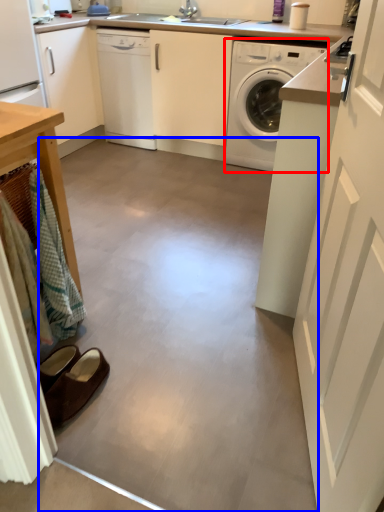
Question: Which object appears farthest to the camera in this image, washing machine (highlighted by a red box) or concrete (highlighted by a blue box)?

Choices:
 (A) washing machine
 (B) concrete

Answer: (A)